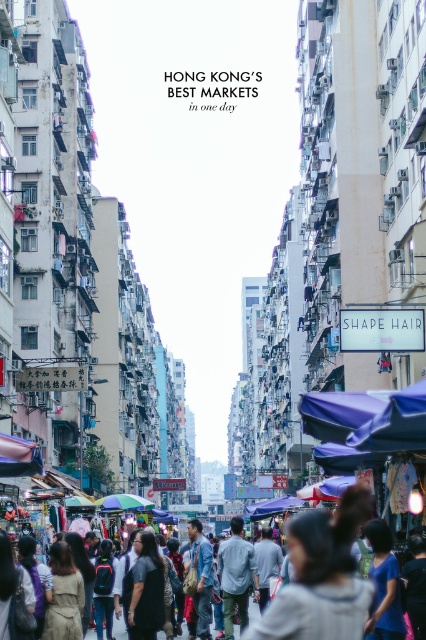
You are a customer at the market and want to buy the light gray cotton shirt at center. However, you are concerned about the purple fabric canopy at center blocking your view. Is the canopy taller than the shirt?

The light gray cotton shirt at center is shorter than the purple fabric canopy at center, so the canopy is taller and may block your view.

You are a customer walking along the street market in Hong Kong. You notice the blue fabric canopy at lower left and the purple fabric canopy at center. Which canopy is positioned higher relative to the other?

The blue fabric canopy at lower left is positioned higher than the purple fabric canopy at center because it is above it.